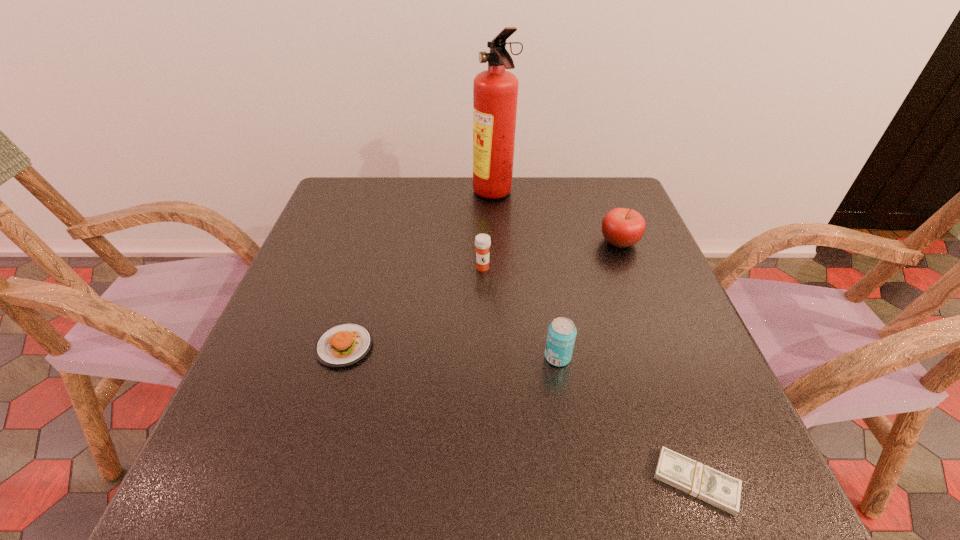
The image size is (960, 540). Find the location of `apple present at the right edge`. apple present at the right edge is located at coordinates (621, 227).

Identify the location of money at the right edge. (705, 483).

The width and height of the screenshot is (960, 540). What are the coordinates of `object that is at the near right corner` in the screenshot? It's located at (705, 483).

Image resolution: width=960 pixels, height=540 pixels. I want to click on free space at the far edge, so click(x=479, y=214).

Find the location of a particular element. This screenshot has width=960, height=540. vacant space at the near edge is located at coordinates (300, 511).

The height and width of the screenshot is (540, 960). I want to click on vacant space at the left edge of the desktop, so click(x=302, y=334).

This screenshot has width=960, height=540. In the image, there is a desktop. Find the location of `vacant space at the right edge`. vacant space at the right edge is located at coordinates tap(598, 227).

The height and width of the screenshot is (540, 960). In the image, there is a desktop. Identify the location of vacant space at the far left corner. (352, 178).

Image resolution: width=960 pixels, height=540 pixels. In the image, there is a desktop. Find the location of `vacant space at the far right corner`. vacant space at the far right corner is located at coordinates (596, 214).

Locate an element on the screen. empty space between the second farthest object and the nearest object is located at coordinates (658, 362).